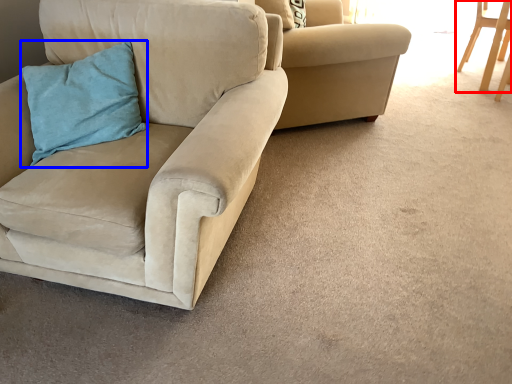
Question: Which object appears farthest to the camera in this image, chair (highlighted by a red box) or pillow (highlighted by a blue box)?

Choices:
 (A) chair
 (B) pillow

Answer: (A)